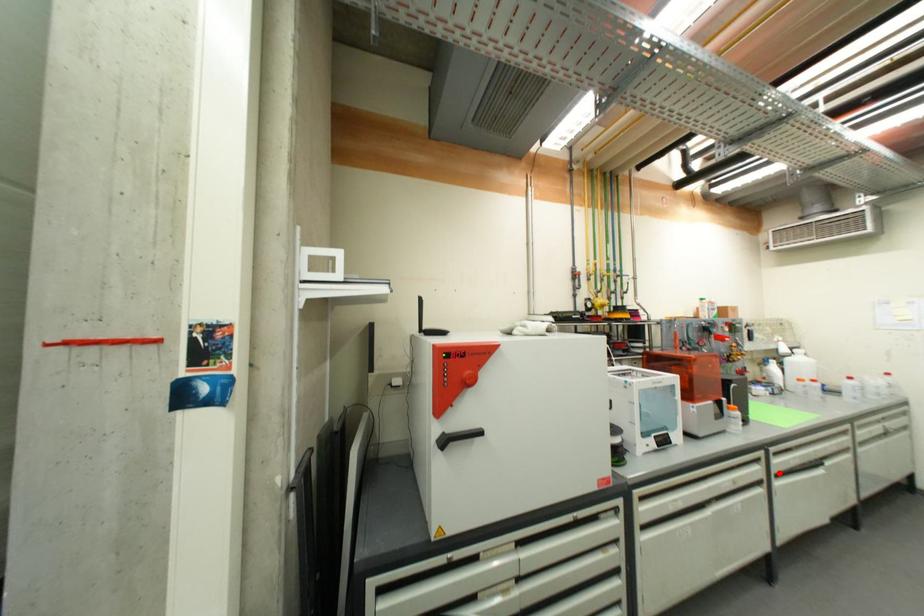
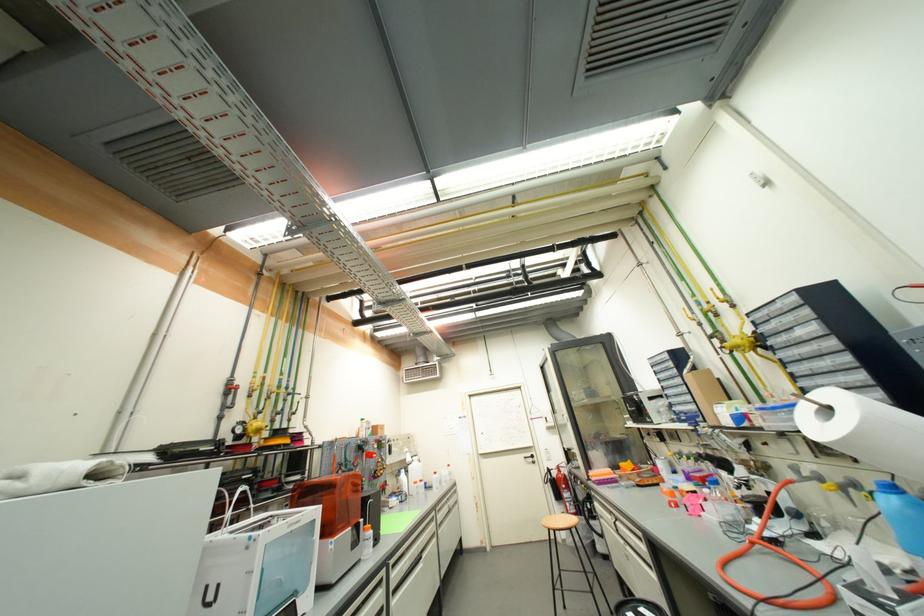
Question: A red point is marked in image1. In image2, is the corresponding 3D point closer to the camera or farther? Reply with the corresponding letter.

Choices:
 (A) The corresponding 3D point is closer.
 (B) The corresponding 3D point is farther.

Answer: (B)